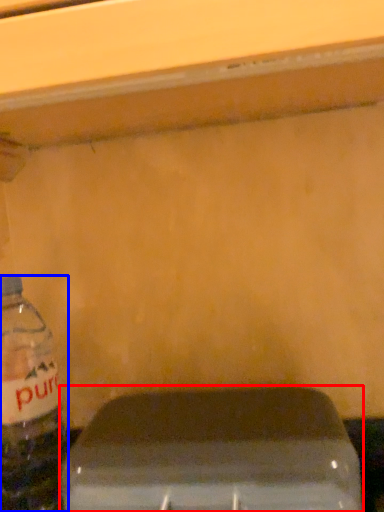
Question: Among these objects, which one is farthest to the camera, appliance (highlighted by a red box) or bottle (highlighted by a blue box)?

Choices:
 (A) appliance
 (B) bottle

Answer: (B)